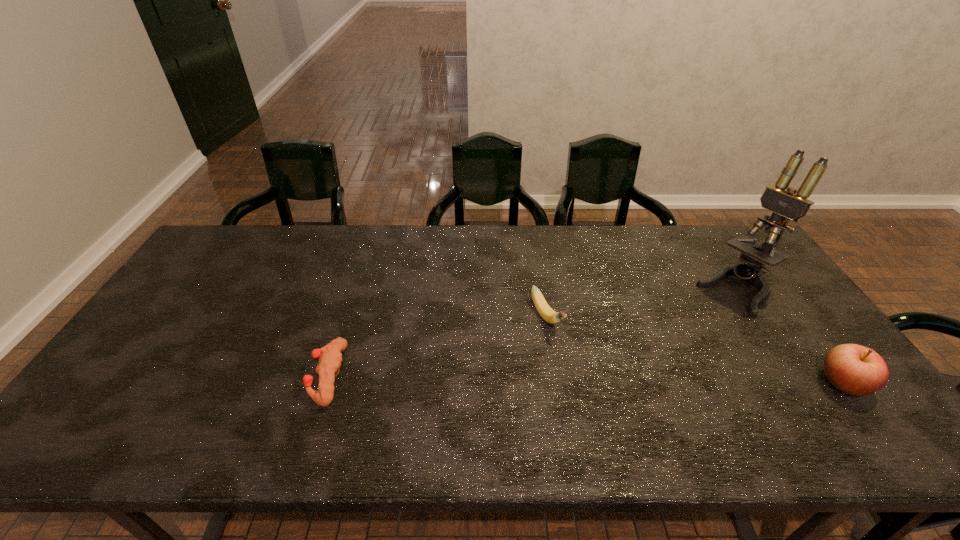
Where is `free location located 0.210m at the stem of the banana`? Image resolution: width=960 pixels, height=540 pixels. free location located 0.210m at the stem of the banana is located at coordinates (595, 401).

Locate an element on the screen. This screenshot has width=960, height=540. vacant area situated 0.250m at the stem of the banana is located at coordinates coord(605,414).

I want to click on free space located at the stem of the banana, so click(580, 378).

Identify the location of free space located 0.360m at the eyepieces of the tallest object. The image size is (960, 540). (644, 370).

You are a GUI agent. You are given a task and a screenshot of the screen. Output one action in this format:
    pyautogui.click(x=<x>, y=<y>)
    Task: Click on the free space located 0.120m at the eyepieces of the tallest object
    This screenshot has height=540, width=960.
    Given the screenshot: What is the action you would take?
    pyautogui.click(x=695, y=327)

This screenshot has width=960, height=540. Find the location of `vacant space located 0.390m at the eyepieces of the tallest object`. vacant space located 0.390m at the eyepieces of the tallest object is located at coordinates (636, 377).

Image resolution: width=960 pixels, height=540 pixels. I want to click on puncher at the near edge, so click(x=330, y=355).

Image resolution: width=960 pixels, height=540 pixels. Identify the location of apple positioned at the near edge. (857, 370).

At what (x,y) coordinates should I click in order to perform the action: click on apple at the right edge. Please return your answer as a coordinate pair (x, y). The image size is (960, 540). Looking at the image, I should click on (857, 370).

Identify the location of microscope that is at the right edge. The width and height of the screenshot is (960, 540). (791, 204).